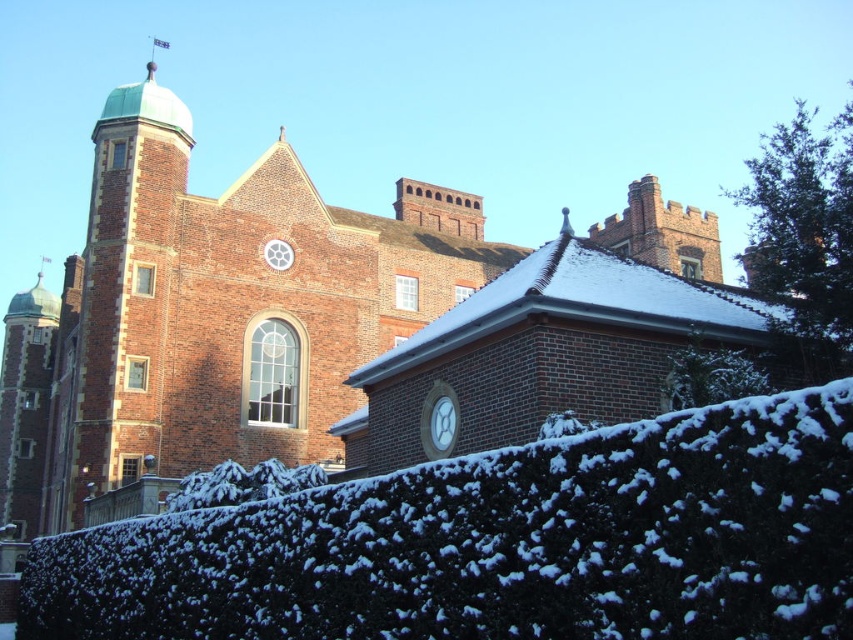
Can you confirm if green leafy bush at upper right is smaller than green leafy bush at upper center?

Actually, green leafy bush at upper right might be larger than green leafy bush at upper center.

Between green leafy bush at upper right and green leafy bush at upper center, which one appears on the right side from the viewer's perspective?

green leafy bush at upper right

Does point (822, 161) come in front of point (701, 364)?

No.

Where is `green leafy bush at upper right`? The width and height of the screenshot is (853, 640). green leafy bush at upper right is located at coordinates (804, 221).

Find the location of a particular element. The width and height of the screenshot is (853, 640). snow-covered hedge at lower center is located at coordinates (502, 544).

Is snow-covered hedge at lower center positioned before green leafy bush at upper center?

Yes, it is.

Find the location of a particular element. The width and height of the screenshot is (853, 640). snow-covered hedge at lower center is located at coordinates (502, 544).

Is green leafy bush at upper right in front of white snow-covered hedge at lower center?

Yes.

Can you confirm if green leafy bush at upper right is bigger than white snow-covered hedge at lower center?

Indeed, green leafy bush at upper right has a larger size compared to white snow-covered hedge at lower center.

Who is more forward, (801, 323) or (283, 477)?

Point (801, 323) is more forward.

The width and height of the screenshot is (853, 640). Find the location of `green leafy bush at upper right`. green leafy bush at upper right is located at coordinates (804, 221).